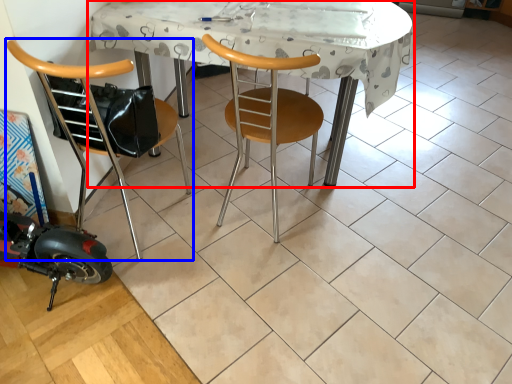
Question: Which of the following is the closest to the observer, table (highlighted by a red box) or chair (highlighted by a blue box)?

Choices:
 (A) table
 (B) chair

Answer: (B)